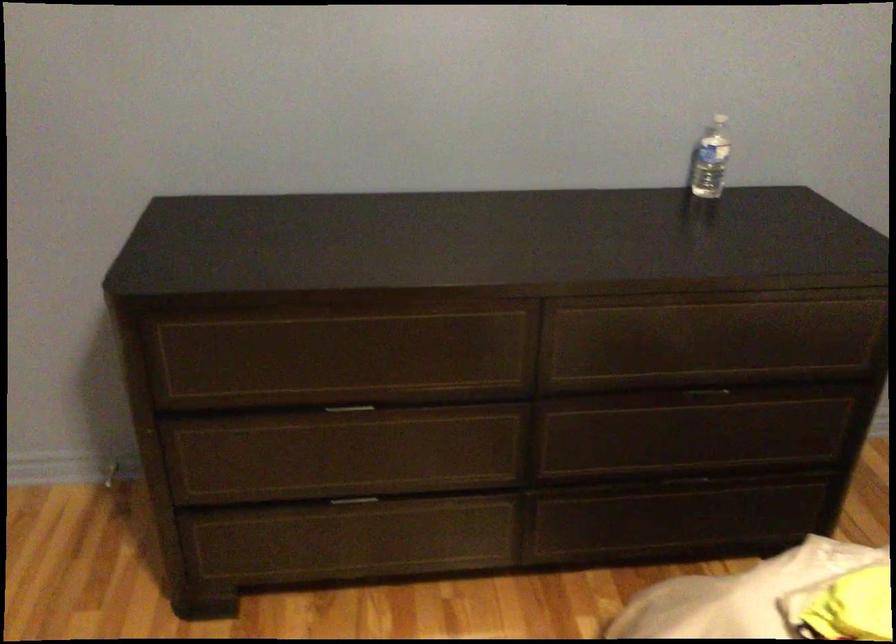
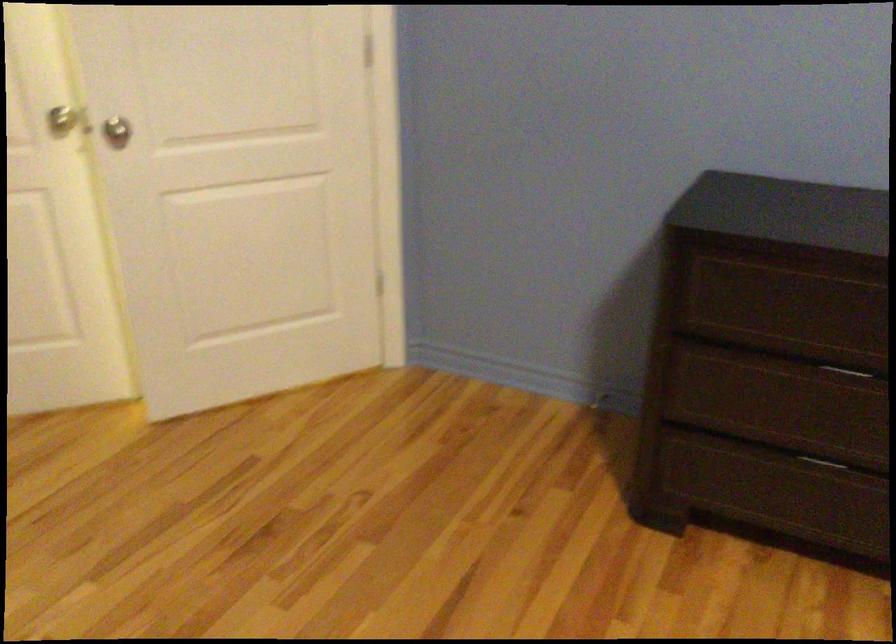
The point at (346,502) is marked in the first image. Where is the corresponding point in the second image?

(821, 462)